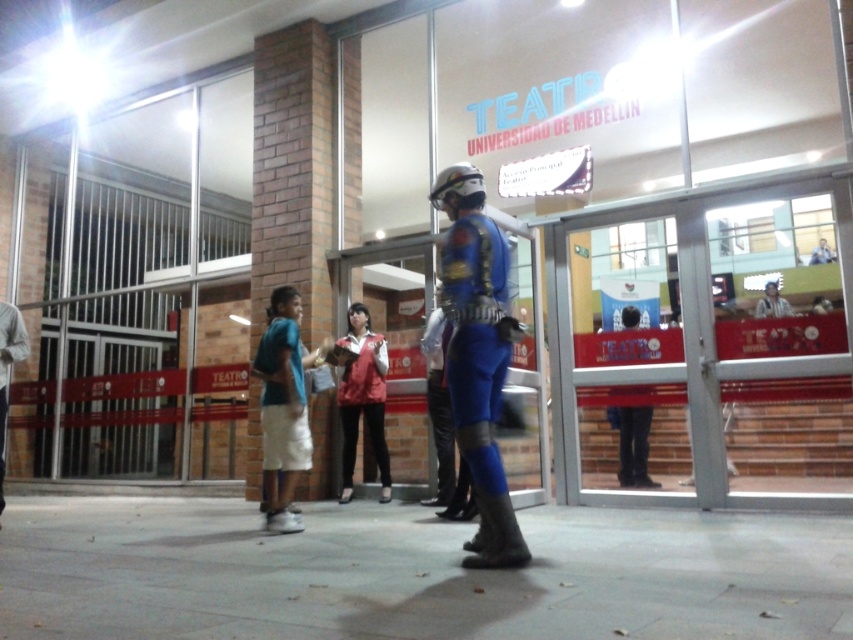
Question: Which of the following is the closest to the observer?

Choices:
 (A) (4, 404)
 (B) (296, 410)
 (C) (631, 433)
 (D) (283, 403)

Answer: (B)

Question: Can you confirm if blue-green fabric shirt at center-left is smaller than dark blue fabric pants at center?

Choices:
 (A) yes
 (B) no

Answer: (A)

Question: Does blue matte suit at center appear on the left side of dark blue fabric pants at center?

Choices:
 (A) yes
 (B) no

Answer: (A)

Question: Is matte blue costume at center above blue fabric pants at left?

Choices:
 (A) yes
 (B) no

Answer: (A)

Question: Estimate the real-world distances between objects in this image. Which object is closer to the matte blue costume at center?

Choices:
 (A) blue fabric pants at left
 (B) blue matte suit at center

Answer: (B)

Question: Among these points, which one is farthest from the camera?

Choices:
 (A) (376, 451)
 (B) (630, 426)
 (C) (461, 332)

Answer: (B)